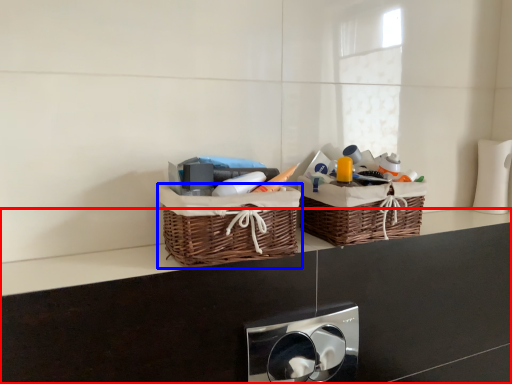
Question: Which point is further to the camera, counter (highlighted by a red box) or picnic basket (highlighted by a blue box)?

Choices:
 (A) counter
 (B) picnic basket

Answer: (B)